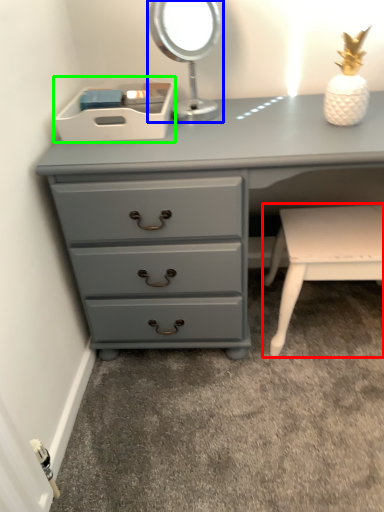
Question: Based on their relative distances, which object is nearer to table (highlighted by a red box)? Choose from bedside lamp (highlighted by a blue box) and storage box (highlighted by a green box).

Choices:
 (A) bedside lamp
 (B) storage box

Answer: (A)